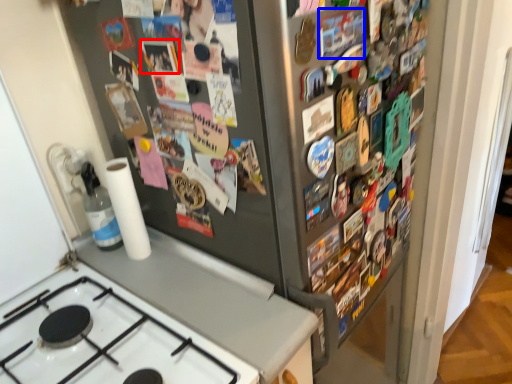
Question: Which object appears closest to the camera in this image, button (highlighted by a red box) or button (highlighted by a blue box)?

Choices:
 (A) button
 (B) button

Answer: (B)